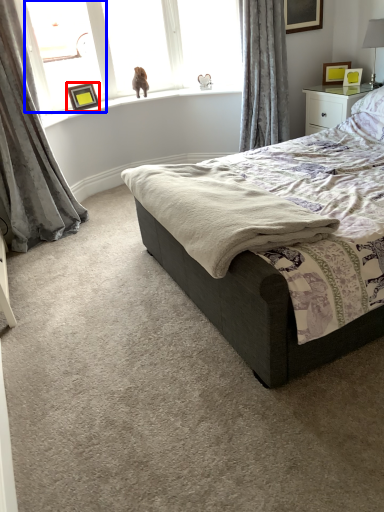
Question: Which object is closer to the camera taking this photo, picture frame (highlighted by a red box) or window screen (highlighted by a blue box)?

Choices:
 (A) picture frame
 (B) window screen

Answer: (B)